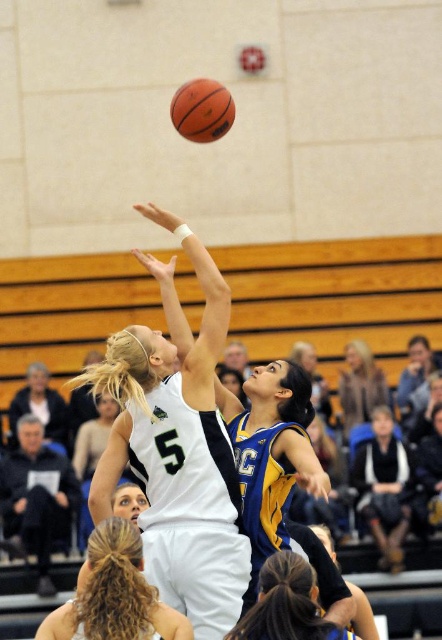
Question: Which object is the closest to the brown leather jacket at upper right?

Choices:
 (A) blue jersey at center
 (B) blonde hair at center
 (C) white jersey at center
 (D) rubber textured basketball at center

Answer: (C)

Question: Is blue jersey at center to the left of rubber textured basketball at center from the viewer's perspective?

Choices:
 (A) no
 (B) yes

Answer: (A)

Question: Does white jersey at center appear under blue jersey at center?

Choices:
 (A) yes
 (B) no

Answer: (B)

Question: Which point is farther to the camera?

Choices:
 (A) blue jersey at center
 (B) blonde hair at center

Answer: (A)

Question: Considering the real-world distances, which object is closest to the white jersey at center?

Choices:
 (A) blonde hair at center
 (B) rubber textured basketball at center

Answer: (A)

Question: Is white jersey at center thinner than rubber textured basketball at center?

Choices:
 (A) yes
 (B) no

Answer: (B)